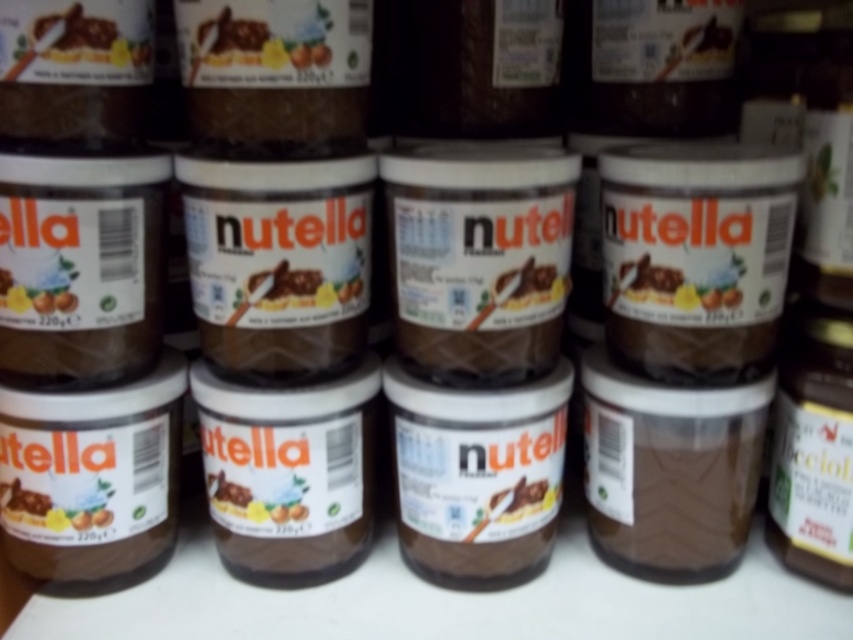
Between point (65, 518) and point (0, 275), which one is positioned in front?

Point (0, 275) is in front.

Measure the distance between matte brown jar at center and camera.

A distance of 38.74 inches exists between matte brown jar at center and camera.

In order to click on matte brown jar at center in this screenshot , I will do `click(50, 508)`.

Can you confirm if matte chocolate spread at center is wider than matte brown jar at center?

Incorrect, matte chocolate spread at center's width does not surpass matte brown jar at center's.

Can you confirm if matte chocolate spread at center is positioned below matte brown jar at center?

Actually, matte chocolate spread at center is above matte brown jar at center.

Which is behind, point (651, 269) or point (19, 508)?

The point (19, 508) is more distant.

Identify the location of matte chocolate spread at center. Image resolution: width=853 pixels, height=640 pixels. (677, 285).

Does matte chocolate spread at center appear on the right side of matte brown jar at left?

Yes, matte chocolate spread at center is to the right of matte brown jar at left.

Does matte chocolate spread at center appear under matte brown jar at left?

No, matte chocolate spread at center is not below matte brown jar at left.

Where is `matte chocolate spread at center`? The width and height of the screenshot is (853, 640). matte chocolate spread at center is located at coordinates (677, 285).